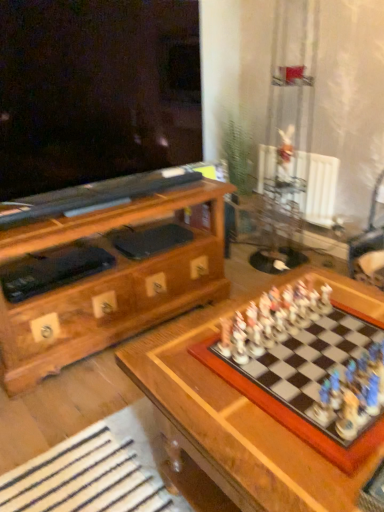
Describe the element at coordinates (318, 187) in the screenshot. This screenshot has height=512, width=384. I see `white plastic radiator at upper right` at that location.

Consider the image. In order to face white plastic radiator at upper right, should I rotate leftwards or rightwards?

A 15.446 degree turn to the right will do.

Image resolution: width=384 pixels, height=512 pixels. Describe the element at coordinates (370, 243) in the screenshot. I see `metallic silver swivel chair at right` at that location.

Measure the distance between metallic silver swivel chair at right and camera.

A distance of 7.35 feet exists between metallic silver swivel chair at right and camera.

Where is `white plastic radiator at upper right`? The width and height of the screenshot is (384, 512). white plastic radiator at upper right is located at coordinates (318, 187).

Does point (147, 342) appear closer or farther from the camera than point (382, 212)?

Point (147, 342) is closer to the camera than point (382, 212).

Is metallic silver swivel chair at right located within wooden chessboard at center?

Definitely not — metallic silver swivel chair at right is not inside wooden chessboard at center.

Considering the relative sizes of wooden chessboard at center and metallic silver swivel chair at right in the image provided, is wooden chessboard at center shorter than metallic silver swivel chair at right?

Yes.

You are a GUI agent. You are given a task and a screenshot of the screen. Output one action in this format:
    pyautogui.click(x=<x>, y=<y>)
    Task: Click on the swivel chair behind the wooden chessboard at center
    
    Given the screenshot: What is the action you would take?
    pyautogui.click(x=370, y=243)

Would you consider white plastic radiator at upper right to be distant from wooden chessboard at center?

Yes, white plastic radiator at upper right is far from wooden chessboard at center.

From the picture: Is white plastic radiator at upper right turned away from wooden chessboard at center?

No, white plastic radiator at upper right is not facing away from wooden chessboard at center.

Where is `table that appears in front of the white plastic radiator at upper right`? table that appears in front of the white plastic radiator at upper right is located at coordinates (245, 410).

Does white plastic radiator at upper right appear on the right side of wooden chessboard at center?

Yes.

Is metallic silver swivel chair at right not near wooden chessboard at center?

Absolutely, metallic silver swivel chair at right is distant from wooden chessboard at center.

Is point (383, 244) positioned before point (309, 283)?

No.

Is metallic silver swivel chair at right positioned beyond the bounds of wooden chessboard at center?

That's correct, metallic silver swivel chair at right is outside of wooden chessboard at center.

Looking at this image, is the surface of metallic silver swivel chair at right in direct contact with white plastic radiator at upper right?

metallic silver swivel chair at right is not next to white plastic radiator at upper right, and they're not touching.

Considering their positions, is metallic silver swivel chair at right located in front of or behind white plastic radiator at upper right?

metallic silver swivel chair at right is in front of white plastic radiator at upper right.

Is white plastic radiator at upper right at the back of metallic silver swivel chair at right?

That's not correct — metallic silver swivel chair at right is not looking away from white plastic radiator at upper right.

From their relative heights in the image, would you say metallic silver swivel chair at right is taller or shorter than white plastic radiator at upper right?

Clearly, metallic silver swivel chair at right is taller compared to white plastic radiator at upper right.

From a real-world perspective, is wooden chessboard at center on white plastic radiator at upper right?

No, from a real-world perspective, wooden chessboard at center is not above white plastic radiator at upper right.

Is wooden chessboard at center situated inside white plastic radiator at upper right or outside?

wooden chessboard at center is not inside white plastic radiator at upper right, it's outside.

Does wooden chessboard at center have a lesser height compared to white plastic radiator at upper right?

Correct, wooden chessboard at center is not as tall as white plastic radiator at upper right.

Does white plastic radiator at upper right appear on the left side of metallic silver swivel chair at right?

Correct, you'll find white plastic radiator at upper right to the left of metallic silver swivel chair at right.

Is white plastic radiator at upper right positioned beyond the bounds of metallic silver swivel chair at right?

Absolutely, white plastic radiator at upper right is external to metallic silver swivel chair at right.

From a real-world perspective, is white plastic radiator at upper right below metallic silver swivel chair at right?

Yes, from a real-world perspective, white plastic radiator at upper right is beneath metallic silver swivel chair at right.

Considering the sizes of white plastic radiator at upper right and metallic silver swivel chair at right in the image, is white plastic radiator at upper right wider or thinner than metallic silver swivel chair at right?

Considering their sizes, white plastic radiator at upper right looks slimmer than metallic silver swivel chair at right.

You are a GUI agent. You are given a task and a screenshot of the screen. Output one action in this format:
    pyautogui.click(x=<x>, y=<y>)
    Task: Click on the swivel chair that appears above the wooden chessboard at center (from a real-world perspective)
    The height and width of the screenshot is (512, 384).
    Given the screenshot: What is the action you would take?
    pyautogui.click(x=370, y=243)

Locate an element on the screen. radiator located above the wooden chessboard at center (from the image's perspective) is located at coordinates (318, 187).

Considering their positions, is wooden chessboard at center positioned further to metallic silver swivel chair at right than white plastic radiator at upper right?

The object further to metallic silver swivel chair at right is wooden chessboard at center.

Which object lies nearer to the anchor point white plastic radiator at upper right, metallic silver swivel chair at right or wooden chessboard at center?

Based on the image, metallic silver swivel chair at right appears to be nearer to white plastic radiator at upper right.

From the image, which object appears to be farther from white plastic radiator at upper right, wooden chessboard at center or metallic silver swivel chair at right?

Based on the image, wooden chessboard at center appears to be further to white plastic radiator at upper right.

Looking at this image, considering their positions, is metallic silver swivel chair at right positioned closer to wooden chessboard at center than white plastic radiator at upper right?

white plastic radiator at upper right.

Based on their spatial positions, is white plastic radiator at upper right or wooden chessboard at center closer to metallic silver swivel chair at right?

Based on the image, white plastic radiator at upper right appears to be nearer to metallic silver swivel chair at right.

From the image, which object appears to be farther from wooden chessboard at center, white plastic radiator at upper right or metallic silver swivel chair at right?

metallic silver swivel chair at right.

Find the location of `swivel chair between wooden chessboard at center and white plastic radiator at upper right in the front-back direction`. swivel chair between wooden chessboard at center and white plastic radiator at upper right in the front-back direction is located at coordinates 370,243.